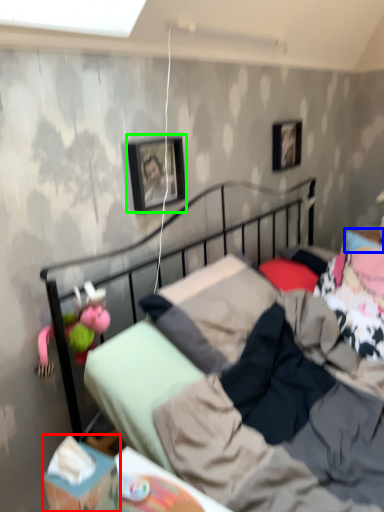
Question: Which is nearer to the box (highlighted by a red box)? pillow (highlighted by a blue box) or picture frame (highlighted by a green box).

Choices:
 (A) pillow
 (B) picture frame

Answer: (B)